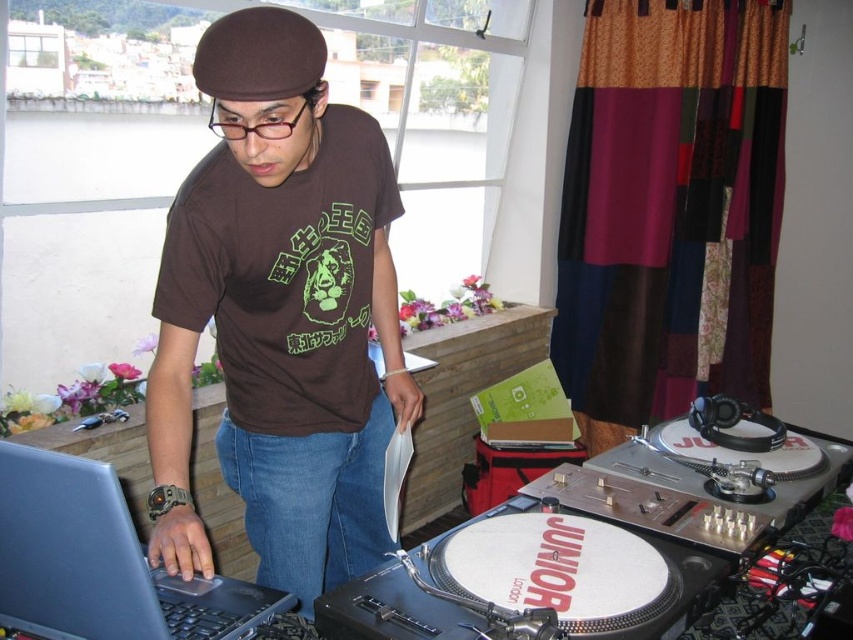
Question: Which of the following is the farthest from the observer?

Choices:
 (A) brown matte t-shirt at center
 (B) matte black laptop at left
 (C) white vinyl turntable at lower right

Answer: (A)

Question: Is brown matte t-shirt at center behind white vinyl turntable at lower right?

Choices:
 (A) no
 (B) yes

Answer: (B)

Question: Which of these objects is positioned closest to the brown matte t-shirt at center?

Choices:
 (A) matte black laptop at left
 (B) white vinyl turntable at lower right

Answer: (A)

Question: Estimate the real-world distances between objects in this image. Which object is farther from the matte black laptop at left?

Choices:
 (A) brown matte t-shirt at center
 (B) white vinyl turntable at lower right

Answer: (B)

Question: Observing the image, what is the correct spatial positioning of white vinyl turntable at lower right in reference to matte black laptop at left?

Choices:
 (A) right
 (B) left

Answer: (A)

Question: Can you confirm if brown matte t-shirt at center is thinner than matte black laptop at left?

Choices:
 (A) yes
 (B) no

Answer: (B)